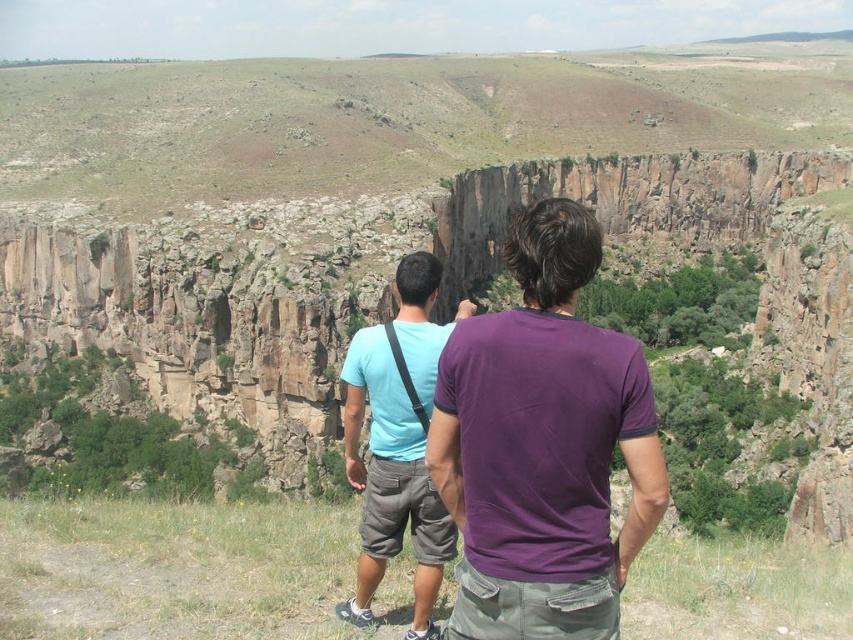
Can you confirm if purple cotton shirt at center is taller than light blue t-shirt at center?

No.

Does purple cotton shirt at center have a larger size compared to light blue t-shirt at center?

No.

Who is more distant from viewer, (509, 260) or (379, 488)?

The point (379, 488) is behind.

Identify the location of purple cotton shirt at center. (543, 445).